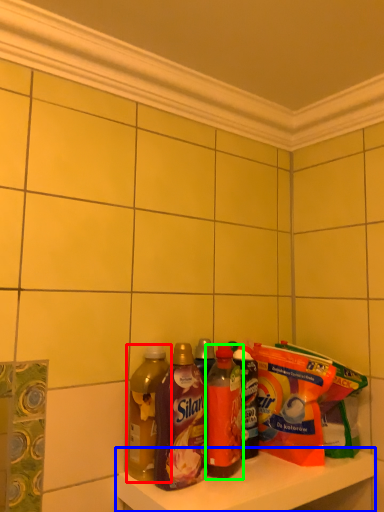
Question: Which object is positioned farthest from bottle (highlighted by a red box)? Select from shelf (highlighted by a blue box) and bottle (highlighted by a green box).

Choices:
 (A) shelf
 (B) bottle

Answer: (A)